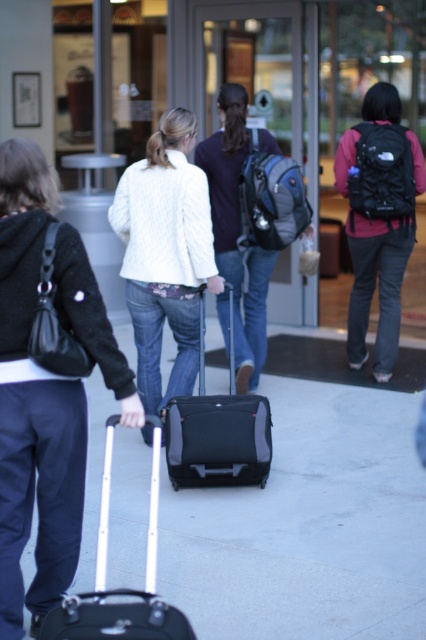
You are standing at the camera position and want to retrieve the matte black suitcase at center. If your maximum reach is 2 meters, can you grab it without moving?

The matte black suitcase at center is 6.19 meters from the camera, which is beyond your 2 meter reach. You cannot grab it without moving closer.

You are standing at the entrance of the hotel and see both the matte black backpack at center and the matte black suitcase at center. Which one is positioned to the right of the other?

The matte black backpack at center is to the right of the matte black suitcase at center.